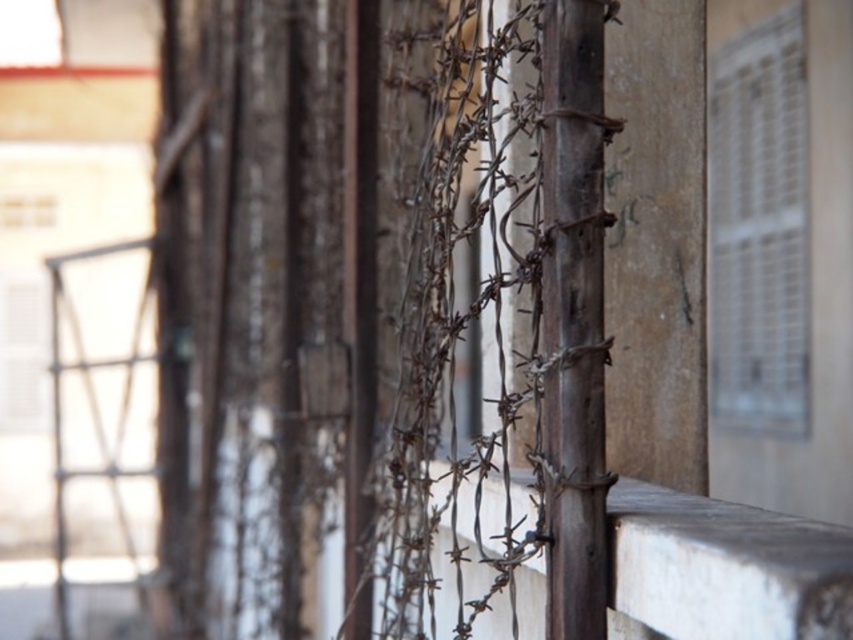
Question: Is rusty wire fence at center bigger than smooth concrete ledge at center?

Choices:
 (A) yes
 (B) no

Answer: (A)

Question: Considering the real-world distances, which object is farthest from the metallic grid at upper right?

Choices:
 (A) rusty wire fence at center
 (B) smooth concrete ledge at center

Answer: (B)

Question: Which object is the farthest from the smooth concrete ledge at center?

Choices:
 (A) metallic grid at upper right
 (B) rusty wire fence at center

Answer: (A)

Question: Is rusty wire fence at center to the left of metallic grid at upper right from the viewer's perspective?

Choices:
 (A) no
 (B) yes

Answer: (B)

Question: Is rusty wire fence at center positioned before smooth concrete ledge at center?

Choices:
 (A) yes
 (B) no

Answer: (B)

Question: Estimate the real-world distances between objects in this image. Which object is closer to the rusty wire fence at center?

Choices:
 (A) smooth concrete ledge at center
 (B) metallic grid at upper right

Answer: (A)